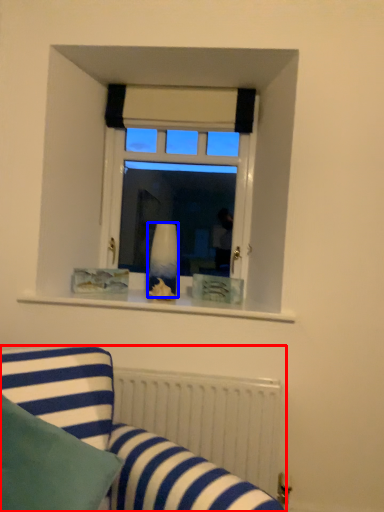
Question: Which object is further to the camera taking this photo, studio couch (highlighted by a red box) or vase (highlighted by a blue box)?

Choices:
 (A) studio couch
 (B) vase

Answer: (B)